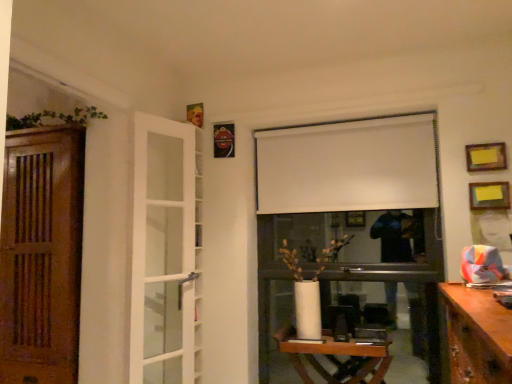
Question: Would you say wooden table at center is a long distance from white matte curtain at upper center?

Choices:
 (A) no
 (B) yes

Answer: (B)

Question: From the image's perspective, does wooden table at center appear higher than white matte curtain at upper center?

Choices:
 (A) no
 (B) yes

Answer: (A)

Question: Is wooden table at center at the right side of white matte curtain at upper center?

Choices:
 (A) no
 (B) yes

Answer: (A)

Question: Is wooden table at center aimed at white matte curtain at upper center?

Choices:
 (A) no
 (B) yes

Answer: (A)

Question: Can we say wooden table at center lies outside white matte curtain at upper center?

Choices:
 (A) yes
 (B) no

Answer: (A)

Question: Is wooden table at center facing away from white matte curtain at upper center?

Choices:
 (A) yes
 (B) no

Answer: (B)

Question: From the image's perspective, is metallic rectangular frame at upper center, which ranks as the 3th picture frame in bottom-to-top order, located beneath white matte curtain at upper center?

Choices:
 (A) no
 (B) yes

Answer: (A)

Question: Is metallic rectangular frame at upper center, marked as the 3th picture frame in a front-to-back arrangement, outside white matte curtain at upper center?

Choices:
 (A) yes
 (B) no

Answer: (A)

Question: Can you confirm if metallic rectangular frame at upper center, which appears as the third picture frame when viewed from the right, is shorter than white matte curtain at upper center?

Choices:
 (A) yes
 (B) no

Answer: (A)

Question: Is metallic rectangular frame at upper center, the 1th picture frame when ordered from left to right, thinner than white matte curtain at upper center?

Choices:
 (A) no
 (B) yes

Answer: (B)

Question: Is white matte curtain at upper center surrounded by metallic rectangular frame at upper center, positioned as the 1th picture frame in top-to-bottom order?

Choices:
 (A) yes
 (B) no

Answer: (B)

Question: Could you tell me if metallic rectangular frame at upper center, marked as the 3th picture frame in a front-to-back arrangement, is facing white matte curtain at upper center?

Choices:
 (A) no
 (B) yes

Answer: (A)

Question: Can you confirm if metallic rectangular frame at upper center, which ranks as the 3th picture frame in bottom-to-top order, is taller than wooden at left, which is the first door from left to right?

Choices:
 (A) no
 (B) yes

Answer: (A)